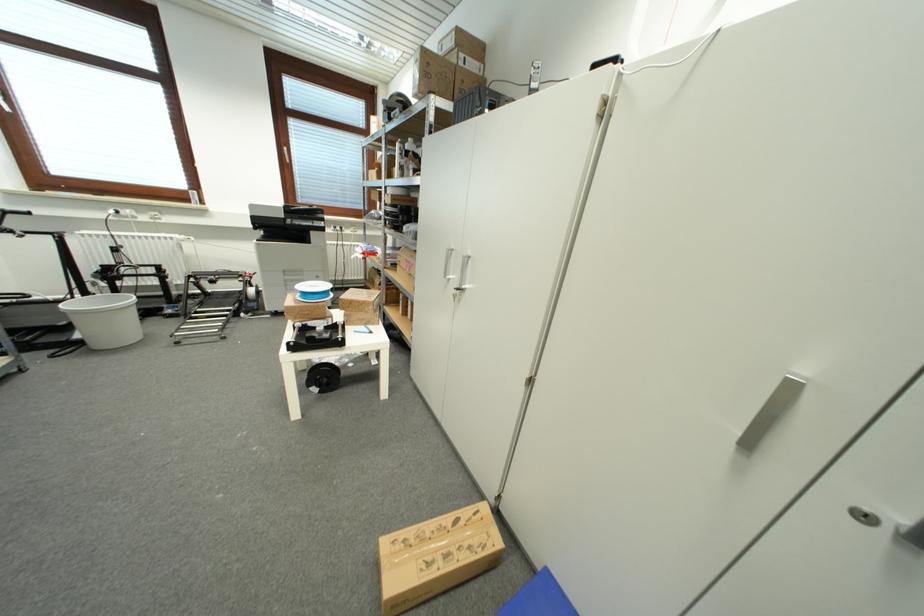
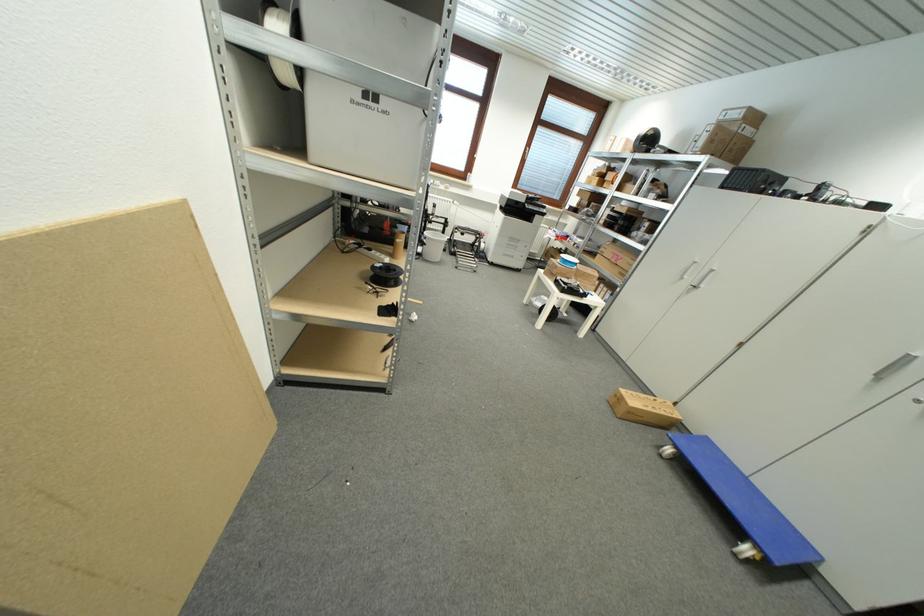
Where in the second image is the point corresponding to the point at 455,45 from the first image?

(742, 116)